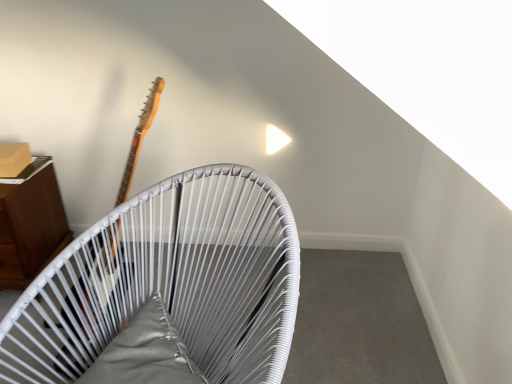
Question: Is wooden cabinet at left, the second furniture positioned from the front, oriented away from wooden guitar at left?

Choices:
 (A) no
 (B) yes

Answer: (A)

Question: Is wooden cabinet at left, marked as the second furniture in a right-to-left arrangement, positioned behind wooden guitar at left?

Choices:
 (A) yes
 (B) no

Answer: (A)

Question: Is wooden cabinet at left, which is the first furniture in back-to-front order, wider than wooden guitar at left?

Choices:
 (A) yes
 (B) no

Answer: (B)

Question: Is wooden cabinet at left, marked as the second furniture in a right-to-left arrangement, outside of wooden guitar at left?

Choices:
 (A) no
 (B) yes

Answer: (B)

Question: From a real-world perspective, is wooden cabinet at left, the second furniture positioned from the front, below wooden guitar at left?

Choices:
 (A) yes
 (B) no

Answer: (A)

Question: Considering the relative positions of white woven chair at upper center, which ranks as the first furniture in right-to-left order, and wooden guitar at left in the image provided, is white woven chair at upper center, which ranks as the first furniture in right-to-left order, to the left or to the right of wooden guitar at left?

Choices:
 (A) right
 (B) left

Answer: (A)

Question: Do you think white woven chair at upper center, which is counted as the 2th furniture, starting from the left, is within wooden guitar at left, or outside of it?

Choices:
 (A) outside
 (B) inside

Answer: (A)

Question: Considering the positions of white woven chair at upper center, which is counted as the second furniture, starting from the back, and wooden guitar at left in the image, is white woven chair at upper center, which is counted as the second furniture, starting from the back, taller or shorter than wooden guitar at left?

Choices:
 (A) short
 (B) tall

Answer: (B)

Question: Looking at their shapes, would you say white woven chair at upper center, which is counted as the 2th furniture, starting from the left, is wider or thinner than wooden guitar at left?

Choices:
 (A) thin
 (B) wide

Answer: (B)

Question: From a real-world perspective, is wooden guitar at left above or below white woven chair at upper center, which ranks as the first furniture in right-to-left order?

Choices:
 (A) below
 (B) above

Answer: (B)

Question: Is wooden guitar at left to the left or to the right of white woven chair at upper center, marked as the first furniture in a front-to-back arrangement, in the image?

Choices:
 (A) right
 (B) left

Answer: (B)

Question: From the image's perspective, is wooden guitar at left located above or below white woven chair at upper center, which is counted as the 2th furniture, starting from the left?

Choices:
 (A) below
 (B) above

Answer: (B)

Question: Would you say wooden guitar at left is inside or outside white woven chair at upper center, which ranks as the first furniture in right-to-left order?

Choices:
 (A) outside
 (B) inside

Answer: (A)

Question: Is wooden cabinet at left, the second furniture positioned from the front, spatially inside white woven chair at upper center, which is counted as the second furniture, starting from the back, or outside of it?

Choices:
 (A) outside
 (B) inside

Answer: (A)

Question: Considering the positions of wooden cabinet at left, marked as the second furniture in a right-to-left arrangement, and white woven chair at upper center, which ranks as the first furniture in right-to-left order, in the image, is wooden cabinet at left, marked as the second furniture in a right-to-left arrangement, wider or thinner than white woven chair at upper center, which ranks as the first furniture in right-to-left order,?

Choices:
 (A) wide
 (B) thin

Answer: (B)